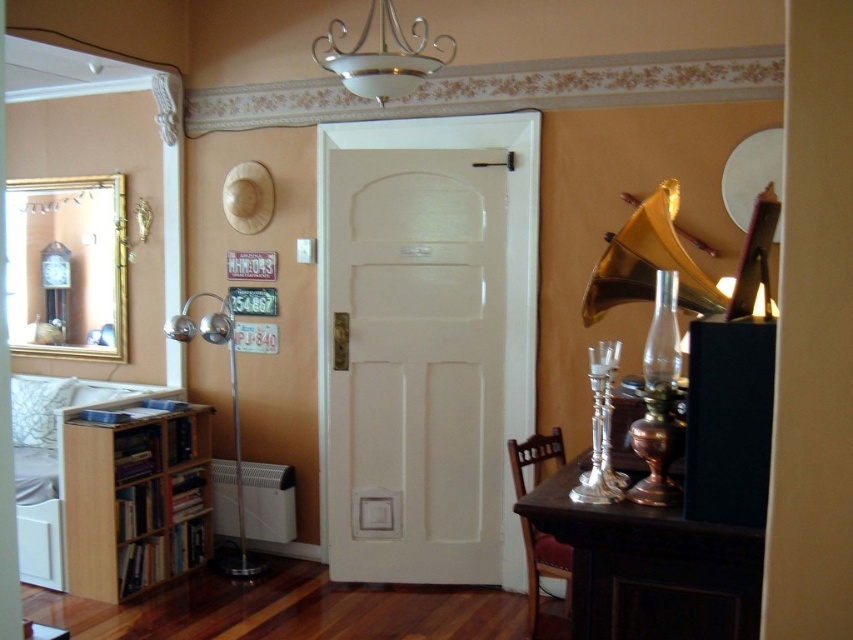
Does white painted wood door at center appear under metallic chandelier at upper center?

Indeed, white painted wood door at center is positioned under metallic chandelier at upper center.

Between white painted wood door at center and metallic chandelier at upper center, which one is positioned higher?

Positioned higher is metallic chandelier at upper center.

What are the coordinates of `white painted wood door at center` in the screenshot? It's located at (415, 364).

Describe the element at coordinates (415, 364) in the screenshot. Image resolution: width=853 pixels, height=640 pixels. I see `white painted wood door at center` at that location.

Does white painted wood door at center have a smaller size compared to light brown wood bookshelf at left?

Actually, white painted wood door at center might be larger than light brown wood bookshelf at left.

Locate an element on the screen. The image size is (853, 640). white painted wood door at center is located at coordinates click(x=415, y=364).

Locate an element on the screen. The width and height of the screenshot is (853, 640). white painted wood door at center is located at coordinates [415, 364].

Can you confirm if dark wood table at right is shorter than metallic chandelier at upper center?

Yes, dark wood table at right is shorter than metallic chandelier at upper center.

Between dark wood table at right and metallic chandelier at upper center, which one has less height?

dark wood table at right is shorter.

The width and height of the screenshot is (853, 640). I want to click on dark wood table at right, so click(x=648, y=566).

Find the location of a particular element. dark wood table at right is located at coordinates (648, 566).